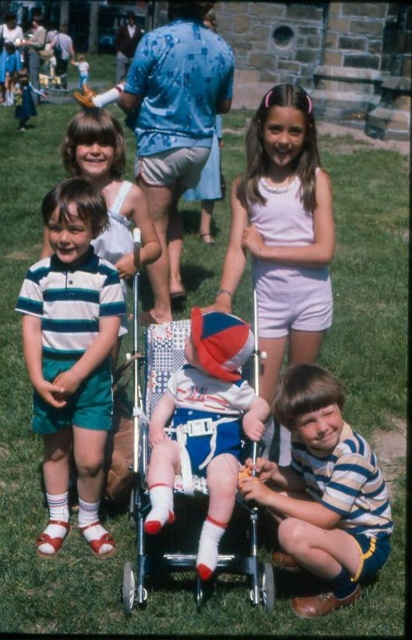
Question: Is striped cotton shirt at lower right smaller than matte blue shirt at center?

Choices:
 (A) no
 (B) yes

Answer: (B)

Question: Is teal striped polo shirt at center smaller than striped cotton shirt at lower right?

Choices:
 (A) yes
 (B) no

Answer: (B)

Question: From the image, what is the correct spatial relationship of matte blue shirt at center in relation to matte blue and white striped shirt at center?

Choices:
 (A) above
 (B) below

Answer: (A)

Question: Considering the real-world distances, which object is closest to the striped cotton shirt at lower right?

Choices:
 (A) matte blue shirt at center
 (B) matte blue and white striped shirt at center

Answer: (B)

Question: Which of the following is the closest to the observer?

Choices:
 (A) (25, 276)
 (B) (358, 499)
 (C) (133, 128)

Answer: (B)

Question: Which object is positioned farthest from the matte blue and white striped shirt at center?

Choices:
 (A) teal striped polo shirt at center
 (B) matte blue shirt at center

Answer: (B)